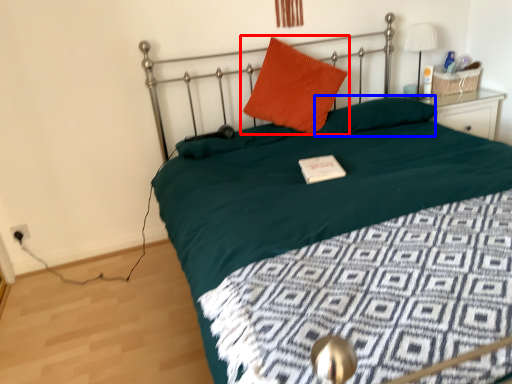
Question: Which object is further to the camera taking this photo, pillow (highlighted by a red box) or pillow (highlighted by a blue box)?

Choices:
 (A) pillow
 (B) pillow

Answer: (B)